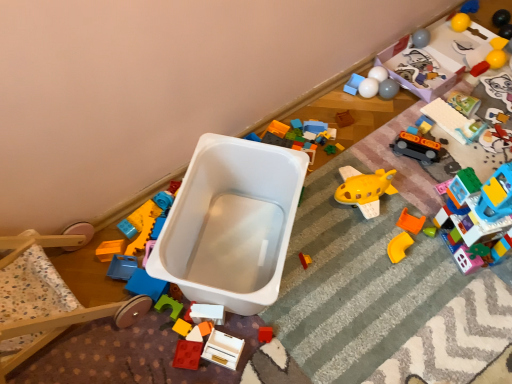
Image resolution: width=512 pixels, height=384 pixels. I want to click on free space that is to the left of translucent plastic building blocks at right, positioned as the 12th toy in left-to-right order, so click(410, 244).